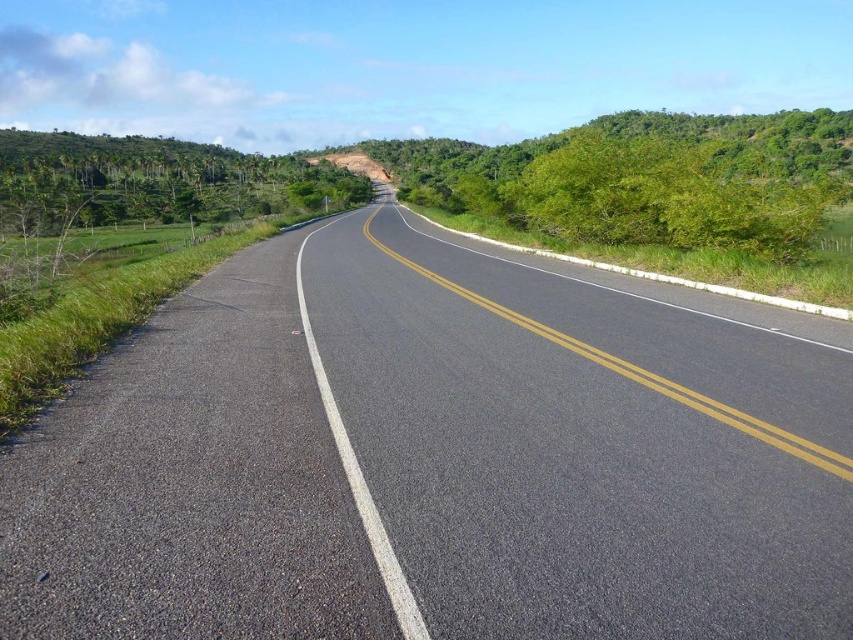
Question: Is asphalt road at center to the left of green leafy trees at left from the viewer's perspective?

Choices:
 (A) yes
 (B) no

Answer: (B)

Question: Which object appears farthest from the camera in this image?

Choices:
 (A) asphalt road at center
 (B) green leafy bush at center
 (C) green leafy trees at left

Answer: (C)

Question: Is green leafy bush at center below green leafy trees at left?

Choices:
 (A) no
 (B) yes

Answer: (B)

Question: Is asphalt road at center to the right of green leafy bush at center from the viewer's perspective?

Choices:
 (A) yes
 (B) no

Answer: (B)

Question: Which of the following is the farthest from the observer?

Choices:
 (A) (728, 170)
 (B) (459, 592)

Answer: (A)

Question: Which point is closer to the camera taking this photo?

Choices:
 (A) (583, 147)
 (B) (804, 602)

Answer: (B)